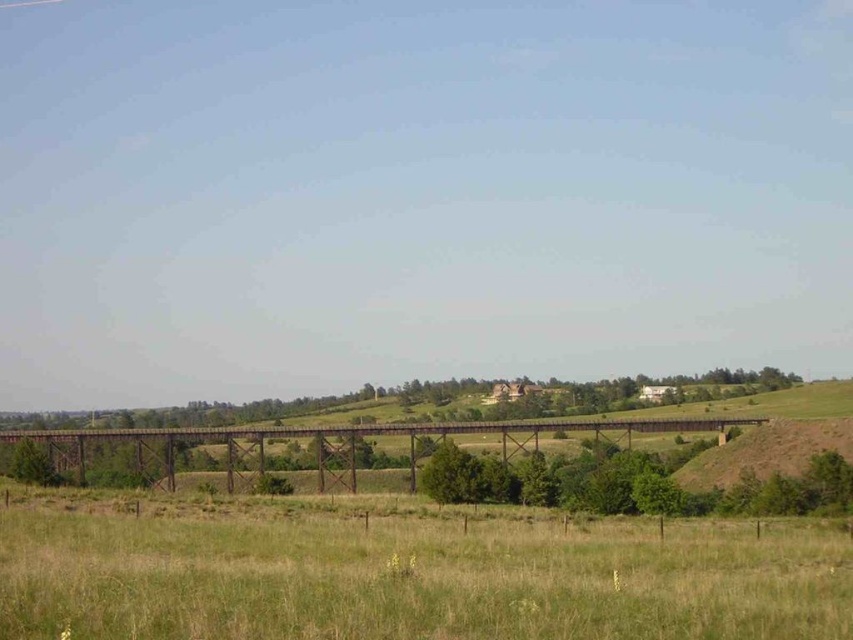
How much distance is there between green grassy field at lower center and rusty metal bridge at center?

green grassy field at lower center is 211.27 feet away from rusty metal bridge at center.

Can you confirm if green grassy field at lower center is bigger than rusty metal bridge at center?

Actually, green grassy field at lower center might be smaller than rusty metal bridge at center.

What do you see at coordinates (405, 572) in the screenshot? The width and height of the screenshot is (853, 640). I see `green grassy field at lower center` at bounding box center [405, 572].

In order to click on green grassy field at lower center in this screenshot , I will do `click(405, 572)`.